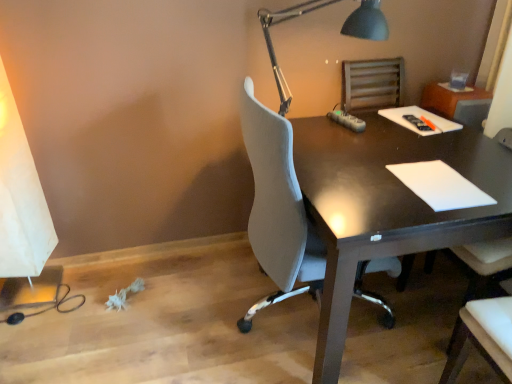
Where is `free space in front of metallic gray desk lamp at upper right`? The height and width of the screenshot is (384, 512). free space in front of metallic gray desk lamp at upper right is located at coordinates (350, 169).